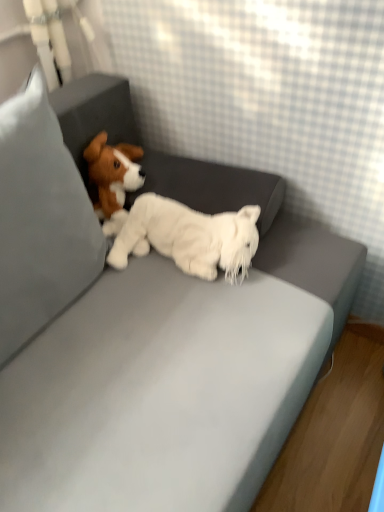
Identify the location of free space on the front side of white plush toy at center. The height and width of the screenshot is (512, 384). (168, 339).